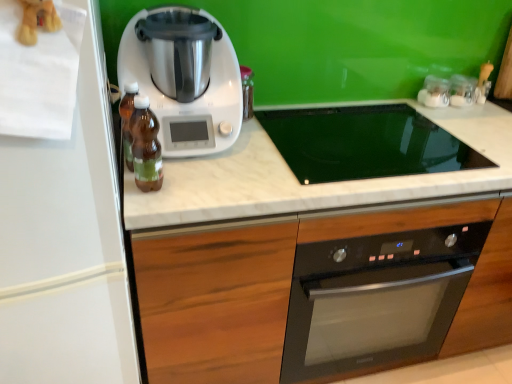
You are a GUI agent. You are given a task and a screenshot of the screen. Output one action in this format:
    pyautogui.click(x=<x>, y=<y>)
    Task: Click on the free space in front of white plastic kitchen appliance at center
    The image size is (512, 384).
    Given the screenshot: What is the action you would take?
    pyautogui.click(x=207, y=185)